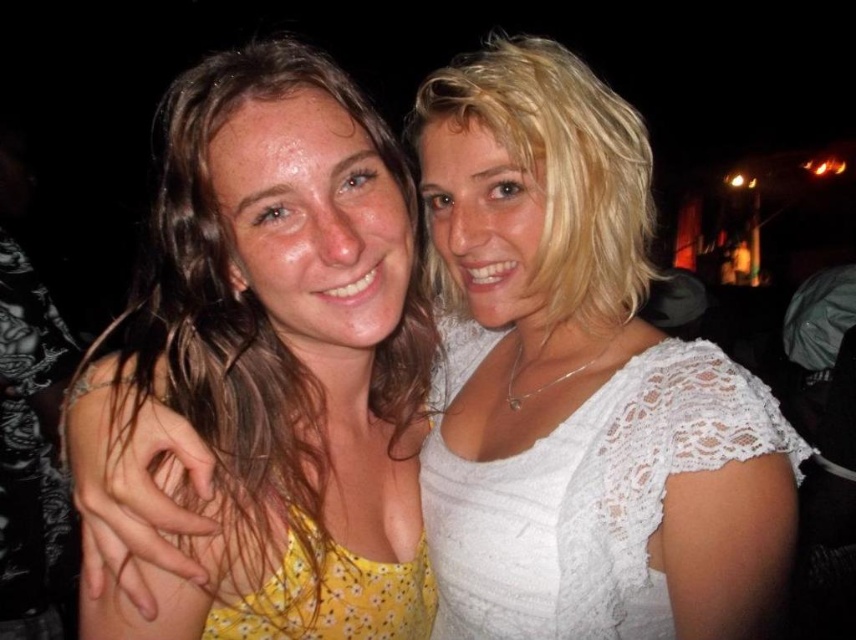
Is yellow floral dress at center shorter than white lace dress at right?

No.

Does point (385, 556) come closer to viewer compared to point (535, 474)?

No, (385, 556) is further to viewer.

Does point (287, 474) lie behind point (681, 417)?

Yes, it is behind point (681, 417).

Find the location of a particular element. The image size is (856, 640). yellow floral dress at center is located at coordinates (277, 360).